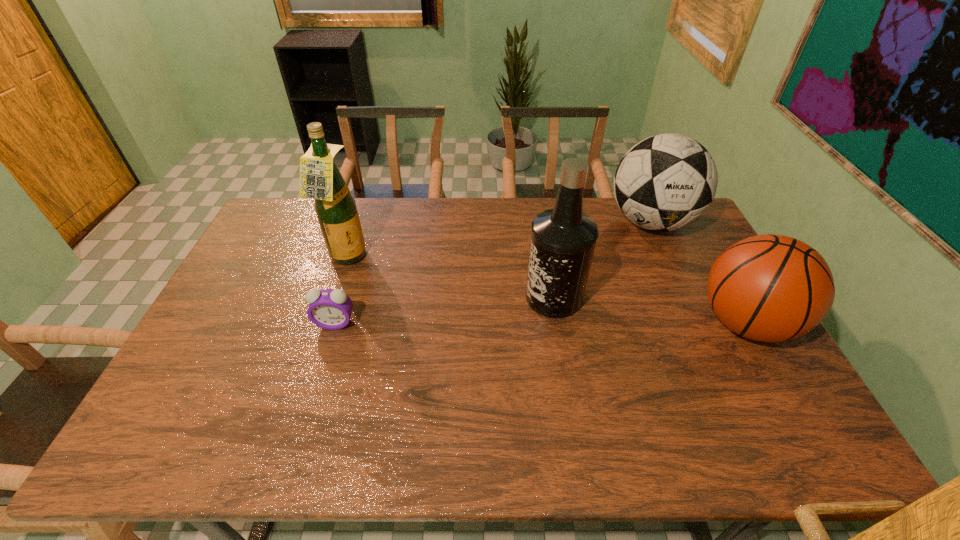
Where is `vacant space situated on the front label of the nearer liquor`? The width and height of the screenshot is (960, 540). vacant space situated on the front label of the nearer liquor is located at coordinates (433, 352).

You are a GUI agent. You are given a task and a screenshot of the screen. Output one action in this format:
    pyautogui.click(x=<x>, y=<y>)
    Task: Click on the blank space located 0.290m on the front-facing side of the left liquor
    
    Given the screenshot: What is the action you would take?
    pyautogui.click(x=433, y=299)

Image resolution: width=960 pixels, height=540 pixels. Find the location of `free spot located 0.100m on the front-facing side of the left liquor`. free spot located 0.100m on the front-facing side of the left liquor is located at coordinates (384, 277).

Identify the location of free spot located 0.250m on the front-facing side of the left liquor. The width and height of the screenshot is (960, 540). (422, 294).

This screenshot has height=540, width=960. I want to click on vacant space located 0.090m on the surface of the soccer ball where the brand logo is visible, so click(x=618, y=257).

The width and height of the screenshot is (960, 540). I want to click on free spot located on the surface of the soccer ball where the brand logo is visible, so click(x=612, y=265).

At what (x,y) coordinates should I click in order to perform the action: click on vacant space located on the surface of the soccer ball where the brand logo is visible. Please return your answer as a coordinate pair (x, y). This screenshot has height=540, width=960. Looking at the image, I should click on (602, 274).

Find the location of a particular element. The height and width of the screenshot is (540, 960). object present at the far edge is located at coordinates (665, 182).

The width and height of the screenshot is (960, 540). What are the coordinates of `basketball that is at the right edge` in the screenshot? It's located at (772, 288).

Where is `soccer ball present at the right edge`? This screenshot has width=960, height=540. soccer ball present at the right edge is located at coordinates (665, 182).